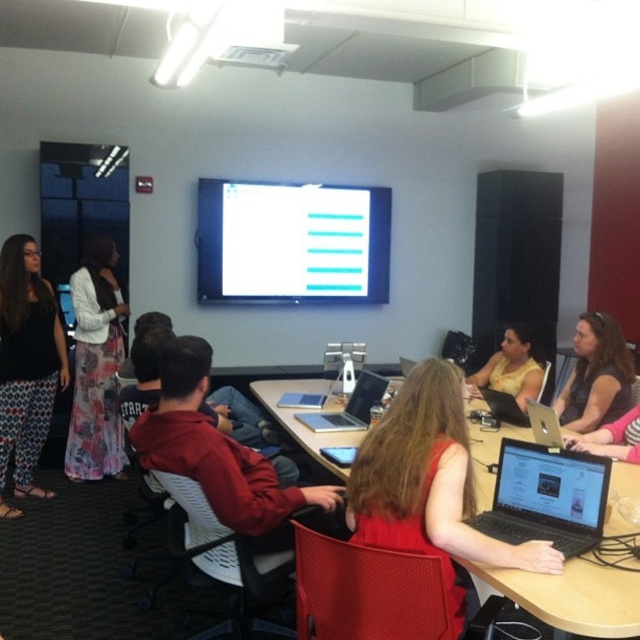
You are organizing a photo shoot in this office setting and need to ensure that the floral dress at left and the satin black laptop at center are both visible in the frame. Given their sizes, which object should you prioritize positioning closer to the camera to maintain clarity?

The floral dress at left is bigger than the satin black laptop at center, so you should prioritize positioning the floral dress at left closer to the camera to maintain clarity.

You are standing at the entrance of the conference room and see the point marked at coordinates (349,406). Which object is this point located on?

The point marked at coordinates (349,406) is located on the satin silver laptop at center.

You are an interior designer planning to install a new lighting fixture in this room. Considering the white glossy projection screen at upper center and the red fabric jacket at center, which object would require more consideration in terms of lighting placement to avoid glare or obstruction?

The white glossy projection screen at upper center would require more consideration in terms of lighting placement because it is bigger than the red fabric jacket at center, making it more prone to glare or obstruction from lights.